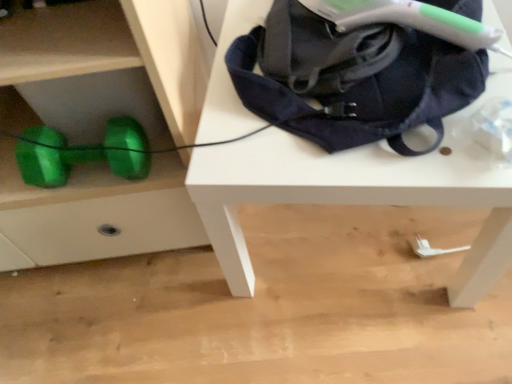
Find the location of a particular element. This screenshot has width=512, height=384. white matte table at upper center is located at coordinates (359, 189).

This screenshot has height=384, width=512. What do you see at coordinates (82, 153) in the screenshot?
I see `green metallic dumbbell at lower left` at bounding box center [82, 153].

The image size is (512, 384). What are the coordinates of `green shiny dumbbell at lower left` in the screenshot? It's located at (104, 69).

Find the location of a particular element. The width and height of the screenshot is (512, 384). white matte table at upper center is located at coordinates [x=359, y=189].

What's the angular difference between green metallic dumbbell at lower left and white matte table at upper center's facing directions?

The angular difference between green metallic dumbbell at lower left and white matte table at upper center is 8.34 degrees.

Is green metallic dumbbell at lower left far away from white matte table at upper center?

Actually, green metallic dumbbell at lower left and white matte table at upper center are a little close together.

From a real-world perspective, between green metallic dumbbell at lower left and white matte table at upper center, who is vertically higher?

From a 3D spatial view, green metallic dumbbell at lower left is above.

In the scene shown: Is green metallic dumbbell at lower left inside the boundaries of white matte table at upper center, or outside?

green metallic dumbbell at lower left is spatially situated outside white matte table at upper center.

Could you tell me if navy blue fabric bag at upper right is turned towards green metallic dumbbell at lower left?

No, navy blue fabric bag at upper right is not aimed at green metallic dumbbell at lower left.

Considering the points (424, 35) and (56, 172), which point is in front, point (424, 35) or point (56, 172)?

Point (424, 35)

Can you confirm if navy blue fabric bag at upper right is shorter than green metallic dumbbell at lower left?

Yes.

Considering the positions of objects navy blue fabric bag at upper right and green metallic dumbbell at lower left in the image provided, who is more to the right, navy blue fabric bag at upper right or green metallic dumbbell at lower left?

navy blue fabric bag at upper right is more to the right.

This screenshot has height=384, width=512. Identify the location of table located below the navy blue fabric bag at upper right (from the image's perspective). (359, 189).

Who is bigger, navy blue fabric bag at upper right or white matte table at upper center?

white matte table at upper center.

Does navy blue fabric bag at upper right come in front of white matte table at upper center?

Yes, it is.

Considering the sizes of navy blue fabric bag at upper right and white matte table at upper center in the image, is navy blue fabric bag at upper right taller or shorter than white matte table at upper center?

In the image, navy blue fabric bag at upper right appears to be shorter than white matte table at upper center.

Does white matte table at upper center have a larger size compared to green shiny dumbbell at lower left?

Incorrect, white matte table at upper center is not larger than green shiny dumbbell at lower left.

Could you tell me if white matte table at upper center is turned towards green shiny dumbbell at lower left?

No, white matte table at upper center is not aimed at green shiny dumbbell at lower left.

Which object is positioned more to the right, white matte table at upper center or green shiny dumbbell at lower left?

white matte table at upper center.

Would you say white matte table at upper center contains green shiny dumbbell at lower left?

No, green shiny dumbbell at lower left is not surrounded by white matte table at upper center.

Is green metallic dumbbell at lower left positioned beyond the bounds of navy blue fabric bag at upper right?

Indeed, green metallic dumbbell at lower left is completely outside navy blue fabric bag at upper right.

Is green metallic dumbbell at lower left thinner than navy blue fabric bag at upper right?

Indeed, green metallic dumbbell at lower left has a lesser width compared to navy blue fabric bag at upper right.

Does green metallic dumbbell at lower left have a larger size compared to navy blue fabric bag at upper right?

No.

Which object is positioned more to the right, green metallic dumbbell at lower left or navy blue fabric bag at upper right?

navy blue fabric bag at upper right.

Is green shiny dumbbell at lower left facing towards navy blue fabric bag at upper right?

No, green shiny dumbbell at lower left is not facing towards navy blue fabric bag at upper right.

Is green shiny dumbbell at lower left next to navy blue fabric bag at upper right and touching it?

No, green shiny dumbbell at lower left is not beside navy blue fabric bag at upper right.

From a real-world perspective, which object stands above the other?

navy blue fabric bag at upper right.

Which of these two, green shiny dumbbell at lower left or navy blue fabric bag at upper right, stands taller?

Standing taller between the two is green shiny dumbbell at lower left.

Is white matte table at upper center completely or partially outside of green metallic dumbbell at lower left?

Absolutely, white matte table at upper center is external to green metallic dumbbell at lower left.

Looking at this image, measure the distance from white matte table at upper center to green metallic dumbbell at lower left.

A distance of 13.45 inches exists between white matte table at upper center and green metallic dumbbell at lower left.

Between white matte table at upper center and green metallic dumbbell at lower left, which one appears on the right side from the viewer's perspective?

Positioned to the right is white matte table at upper center.

Where is `dumbbell that appears above the white matte table at upper center (from a real-world perspective)`? This screenshot has height=384, width=512. dumbbell that appears above the white matte table at upper center (from a real-world perspective) is located at coordinates (82, 153).

You are a GUI agent. You are given a task and a screenshot of the screen. Output one action in this format:
    pyautogui.click(x=<x>, y=<y>)
    Task: Click on the bag lying above the green metallic dumbbell at lower left (from the image's perspective)
    This screenshot has width=512, height=384.
    Given the screenshot: What is the action you would take?
    pyautogui.click(x=352, y=78)

From the image, which object appears to be farther from navy blue fabric bag at upper right, white matte table at upper center or green shiny dumbbell at lower left?

Among the two, green shiny dumbbell at lower left is located further to navy blue fabric bag at upper right.

Which object lies nearer to the anchor point navy blue fabric bag at upper right, white matte table at upper center or green metallic dumbbell at lower left?

white matte table at upper center is positioned closer to the anchor navy blue fabric bag at upper right.

Estimate the real-world distances between objects in this image. Which object is further from navy blue fabric bag at upper right, green metallic dumbbell at lower left or white matte table at upper center?

green metallic dumbbell at lower left.

Considering their positions, is green metallic dumbbell at lower left positioned closer to green shiny dumbbell at lower left than white matte table at upper center?

green metallic dumbbell at lower left.

Which object lies nearer to the anchor point green shiny dumbbell at lower left, navy blue fabric bag at upper right or green metallic dumbbell at lower left?

Among the two, green metallic dumbbell at lower left is located nearer to green shiny dumbbell at lower left.

When comparing their distances from white matte table at upper center, does navy blue fabric bag at upper right or green shiny dumbbell at lower left seem further?

Among the two, green shiny dumbbell at lower left is located further to white matte table at upper center.

From the image, which object appears to be nearer to white matte table at upper center, green metallic dumbbell at lower left or navy blue fabric bag at upper right?

Among the two, navy blue fabric bag at upper right is located nearer to white matte table at upper center.

Based on their spatial positions, is green shiny dumbbell at lower left or green metallic dumbbell at lower left further from white matte table at upper center?

green metallic dumbbell at lower left is further to white matte table at upper center.

I want to click on bag between green metallic dumbbell at lower left and white matte table at upper center in the horizontal direction, so click(x=352, y=78).

At what (x,y) coordinates should I click in order to perform the action: click on dumbbell between green shiny dumbbell at lower left and navy blue fabric bag at upper right from left to right. Please return your answer as a coordinate pair (x, y). This screenshot has width=512, height=384. Looking at the image, I should click on (82, 153).

The height and width of the screenshot is (384, 512). In order to click on dumbbell between green shiny dumbbell at lower left and white matte table at upper center in the horizontal direction in this screenshot , I will do `click(82, 153)`.

Locate an element on the screen. bag between green shiny dumbbell at lower left and white matte table at upper center from left to right is located at coordinates (352, 78).